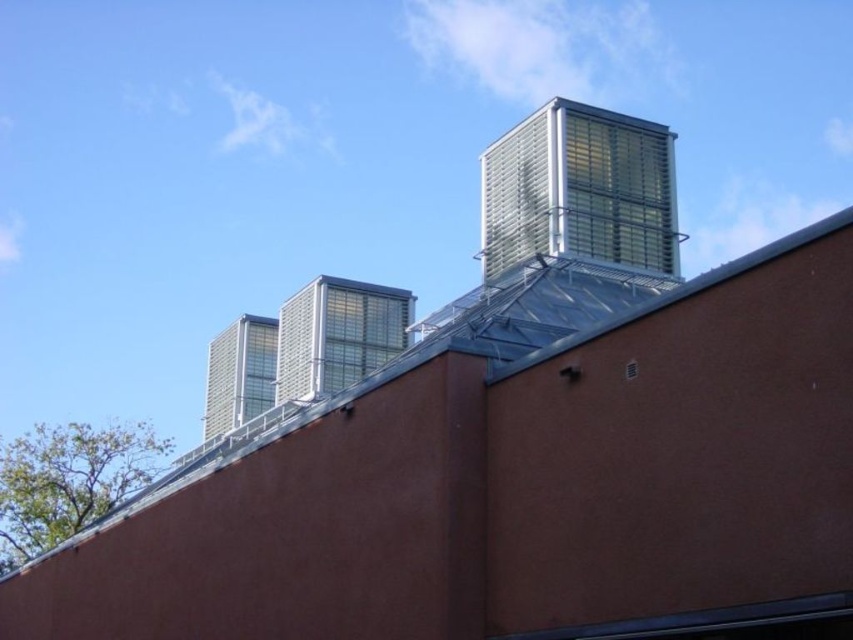
Is point (492, 250) positioned after point (212, 413)?

That is False.

From the picture: Is metallic grid tower at upper right wider than metallic silver vent at center?

No, metallic grid tower at upper right is not wider than metallic silver vent at center.

What do you see at coordinates (579, 189) in the screenshot? The image size is (853, 640). I see `metallic grid tower at upper right` at bounding box center [579, 189].

The width and height of the screenshot is (853, 640). I want to click on metallic grid tower at upper right, so click(x=579, y=189).

Is metallic grid structure at center smaller than metallic silver vent at center?

Indeed, metallic grid structure at center has a smaller size compared to metallic silver vent at center.

Is metallic grid structure at center taller than metallic silver vent at center?

In fact, metallic grid structure at center may be shorter than metallic silver vent at center.

Is point (321, 284) closer to viewer compared to point (264, 360)?

That is True.

Where is `metallic grid structure at center`? metallic grid structure at center is located at coordinates (337, 333).

Does metallic grid tower at upper right appear on the left side of metallic grid structure at center?

No, metallic grid tower at upper right is not to the left of metallic grid structure at center.

Is metallic grid tower at upper right shorter than metallic grid structure at center?

Incorrect, metallic grid tower at upper right's height does not fall short of metallic grid structure at center's.

Who is more forward, (544, 200) or (322, 339)?

Point (544, 200) is more forward.

This screenshot has height=640, width=853. In order to click on metallic grid tower at upper right in this screenshot , I will do `click(579, 189)`.